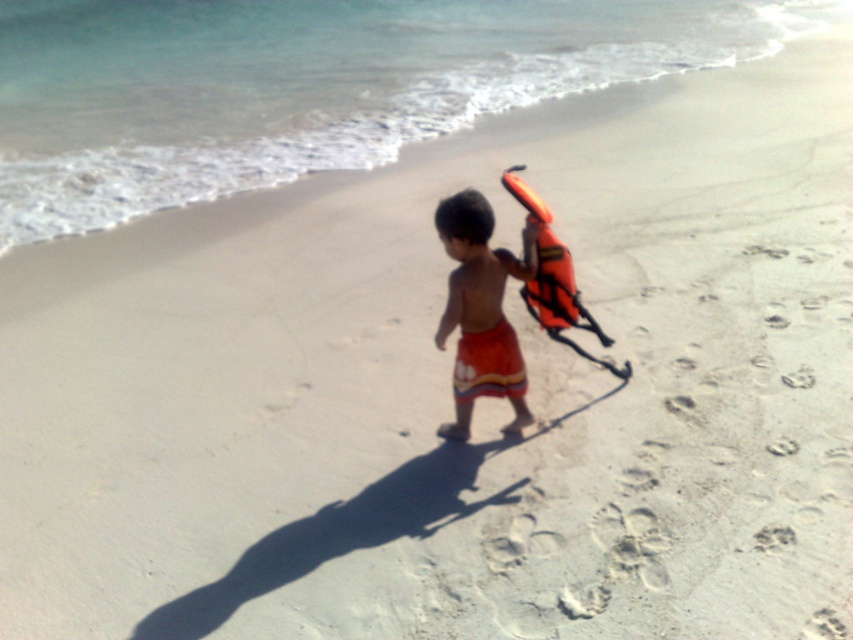
Which is more to the right, orange fabric life vest at center or orange fabric shorts at center?

orange fabric life vest at center

Which is in front, point (476, 323) or point (492, 266)?

Point (492, 266)

At what (x,y) coordinates should I click in order to perform the action: click on orange fabric life vest at center. Please return your answer as a coordinate pair (x, y). Image resolution: width=853 pixels, height=640 pixels. Looking at the image, I should click on (480, 310).

Is orange fabric life vest at center to the right of orange fabric life jacket at right from the viewer's perspective?

No, orange fabric life vest at center is not to the right of orange fabric life jacket at right.

Is point (467, 392) farther from viewer compared to point (556, 305)?

No.

This screenshot has width=853, height=640. What do you see at coordinates (480, 310) in the screenshot? I see `orange fabric life vest at center` at bounding box center [480, 310].

Image resolution: width=853 pixels, height=640 pixels. I want to click on orange fabric life vest at center, so click(x=480, y=310).

Does orange fabric shorts at center have a lesser width compared to orange fabric life jacket at right?

Incorrect, orange fabric shorts at center's width is not less than orange fabric life jacket at right's.

Between point (448, 308) and point (570, 310), which one is positioned behind?

The point (570, 310) is more distant.

The image size is (853, 640). Identify the location of orange fabric shorts at center. (476, 291).